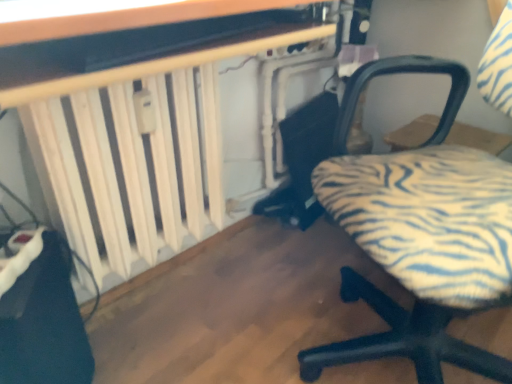
Question: From the image's perspective, is white wooden radiator at left, which is the 2th table in front-to-back order, on top of wooden table at upper center, which is the 2th table from back to front?

Choices:
 (A) yes
 (B) no

Answer: (B)

Question: From a real-world perspective, does white wooden radiator at left, which is the 2th table in front-to-back order, stand above wooden table at upper center, which is the 2th table from back to front?

Choices:
 (A) no
 (B) yes

Answer: (A)

Question: Is white wooden radiator at left, which is the first table in back-to-front order, at the left side of wooden table at upper center, which is the 2th table from back to front?

Choices:
 (A) yes
 (B) no

Answer: (A)

Question: Is wooden table at upper center, arranged as the first table when viewed from the front, surrounded by white wooden radiator at left, which is the first table in back-to-front order?

Choices:
 (A) no
 (B) yes

Answer: (A)

Question: Is white wooden radiator at left, which is the first table in back-to-front order, taller than wooden table at upper center, arranged as the first table when viewed from the front?

Choices:
 (A) yes
 (B) no

Answer: (A)

Question: Can you confirm if white wooden radiator at left, which is the 2th table in front-to-back order, is thinner than wooden table at upper center, arranged as the first table when viewed from the front?

Choices:
 (A) yes
 (B) no

Answer: (B)

Question: Does zebra-patterned fabric chair at lower right have a larger size compared to wooden table at upper center, which is the 2th table from back to front?

Choices:
 (A) no
 (B) yes

Answer: (B)

Question: Is zebra-patterned fabric chair at lower right in front of wooden table at upper center, which is the 2th table from back to front?

Choices:
 (A) no
 (B) yes

Answer: (B)

Question: From a real-world perspective, is zebra-patterned fabric chair at lower right positioned over wooden table at upper center, which is the 2th table from back to front, based on gravity?

Choices:
 (A) yes
 (B) no

Answer: (B)

Question: Is zebra-patterned fabric chair at lower right positioned behind wooden table at upper center, arranged as the first table when viewed from the front?

Choices:
 (A) yes
 (B) no

Answer: (B)

Question: Is zebra-patterned fabric chair at lower right positioned far away from wooden table at upper center, which is the 2th table from back to front?

Choices:
 (A) yes
 (B) no

Answer: (B)

Question: Does zebra-patterned fabric chair at lower right have a greater height compared to wooden table at upper center, arranged as the first table when viewed from the front?

Choices:
 (A) no
 (B) yes

Answer: (B)

Question: From the image's perspective, is zebra-patterned fabric chair at lower right below white wooden radiator at left, which is the 2th table in front-to-back order?

Choices:
 (A) no
 (B) yes

Answer: (B)